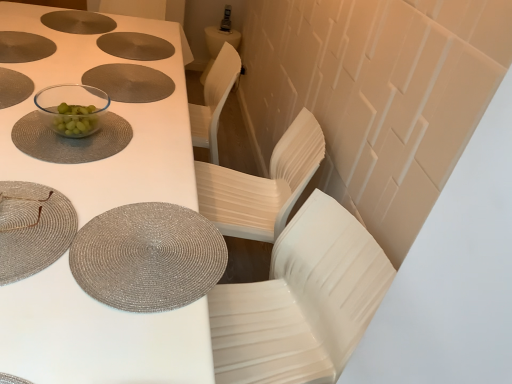
The image size is (512, 384). Identify the location of vacant area that lies between silver textured placemat at lower left, arranged as the fifth tableware when viewed from the top, and transparent glass bowl at center, which ranks as the 3th tableware in bottom-to-top order. (121, 168).